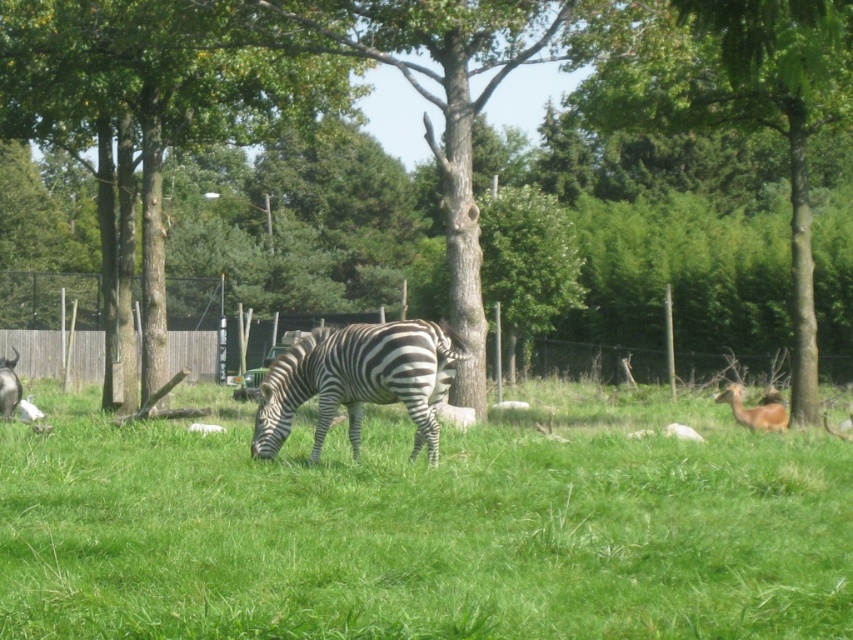
Which of these two, black and white striped zebra at center or brown furry deer at right, stands shorter?

brown furry deer at right is shorter.

I want to click on black and white striped zebra at center, so (358, 380).

Is the position of brown textured tree at center more distant than that of green leafy tree at center?

Yes, it is.

Between brown textured tree at center and green leafy tree at center, which one appears on the right side from the viewer's perspective?

Positioned to the right is green leafy tree at center.

Is point (415, 32) behind point (633, 83)?

No, (415, 32) is in front of (633, 83).

The image size is (853, 640). Identify the location of brown textured tree at center. (488, 157).

Does green grassy at center appear on the right side of brown furry deer at right?

In fact, green grassy at center is to the left of brown furry deer at right.

Does green grassy at center appear on the left side of brown furry deer at right?

Correct, you'll find green grassy at center to the left of brown furry deer at right.

Measure the distance between green grassy at center and camera.

The distance of green grassy at center from camera is 6.01 meters.

Identify the location of green grassy at center. This screenshot has height=640, width=853. (424, 528).